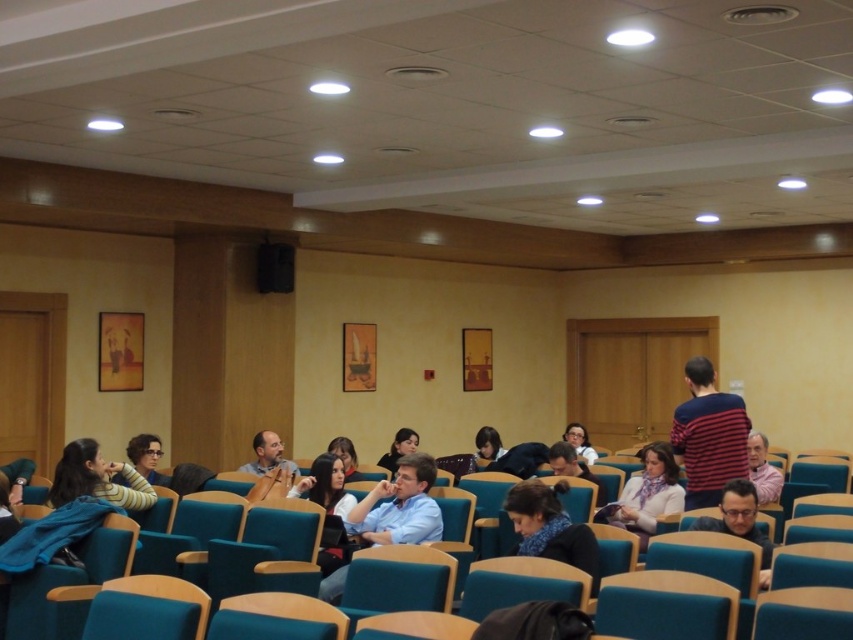
Question: Can you confirm if teal fabric chair at lower center is positioned below striped sweater at lower left?

Choices:
 (A) no
 (B) yes

Answer: (B)

Question: Can you confirm if striped cotton shirt at center is positioned to the left of matte black jacket at center?

Choices:
 (A) yes
 (B) no

Answer: (B)

Question: Which point is farther from the camera taking this photo?

Choices:
 (A) (158, 483)
 (B) (349, 518)
 (C) (579, 538)

Answer: (A)

Question: Which point is farther to the camera?

Choices:
 (A) dark blue scarf at center
 (B) pink fabric shirt at lower right

Answer: (B)

Question: Does dark blue scarf at center lie in front of matte black glasses at center?

Choices:
 (A) yes
 (B) no

Answer: (A)

Question: Which point is closer to the camera?

Choices:
 (A) matte black jacket at center
 (B) light blue fabric jacket at center

Answer: (B)